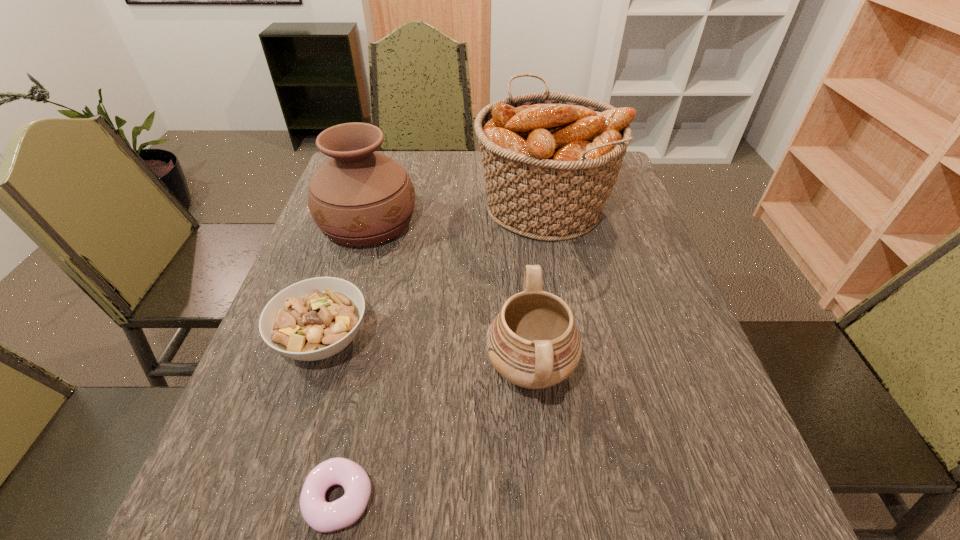
This screenshot has width=960, height=540. I want to click on vacant area situated on the front-facing side of the third shortest object, so click(x=283, y=369).

This screenshot has height=540, width=960. Identify the location of blank area located on the front-facing side of the third shortest object. (455, 369).

Where is `blank space located 0.370m on the front-facing side of the third shortest object`? blank space located 0.370m on the front-facing side of the third shortest object is located at coordinates (299, 369).

Where is `free region located on the right of the stew`? This screenshot has width=960, height=540. free region located on the right of the stew is located at coordinates (410, 340).

Locate an element on the screen. This screenshot has width=960, height=540. vacant space located 0.310m on the back of the doughnut is located at coordinates (377, 322).

Locate an element on the screen. object that is at the far edge is located at coordinates (550, 160).

The height and width of the screenshot is (540, 960). Find the location of `object that is at the near edge`. object that is at the near edge is located at coordinates (322, 516).

You are a GUI agent. You are given a task and a screenshot of the screen. Output one action in this format:
    pyautogui.click(x=<x>, y=<y>)
    Task: Click on the urn at the left edge
    The height and width of the screenshot is (540, 960).
    Given the screenshot: What is the action you would take?
    pyautogui.click(x=359, y=197)

Locate an element on the screen. stew located at the left edge is located at coordinates tap(316, 318).

This screenshot has height=540, width=960. In order to click on object at the right edge in this screenshot , I will do `click(550, 160)`.